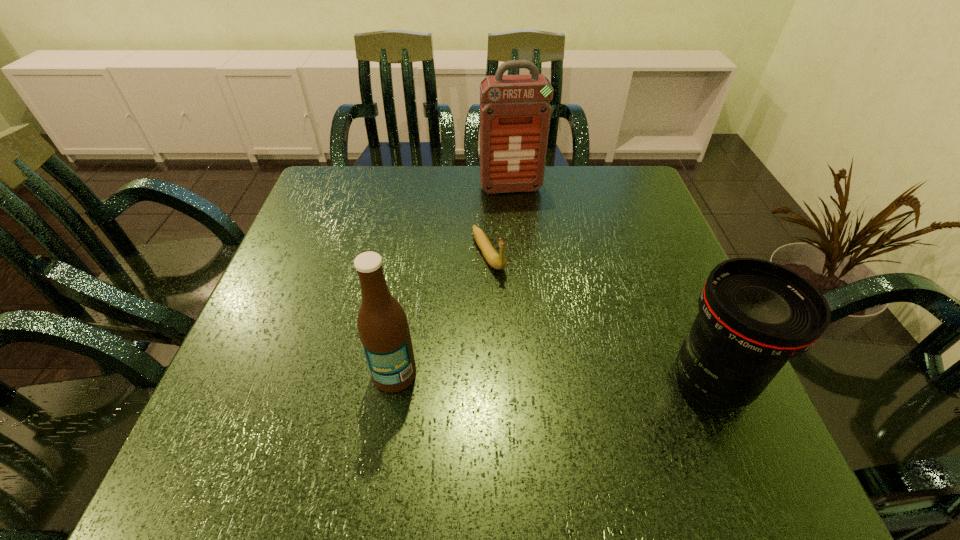
The image size is (960, 540). I want to click on free space located on the front-facing side of the first-aid kit, so click(519, 218).

Locate an element on the screen. Image resolution: width=960 pixels, height=540 pixels. vacant space located 0.260m on the front-facing side of the first-aid kit is located at coordinates (531, 261).

The height and width of the screenshot is (540, 960). I want to click on free space located on the front-facing side of the first-aid kit, so click(525, 241).

In order to click on vacant space located at the stem of the second farthest object in this screenshot , I will do `click(526, 325)`.

The height and width of the screenshot is (540, 960). In order to click on blank area located at the stem of the second farthest object in this screenshot , I will do `click(505, 291)`.

This screenshot has height=540, width=960. Identify the location of vacant region located 0.170m at the stem of the second farthest object. (531, 333).

Locate an element on the screen. The width and height of the screenshot is (960, 540). object that is positioned at the far edge is located at coordinates (515, 112).

Where is `beer bottle present at the near edge`? The image size is (960, 540). beer bottle present at the near edge is located at coordinates [x=382, y=324].

Where is `telephoto lens that is at the near edge`? The height and width of the screenshot is (540, 960). telephoto lens that is at the near edge is located at coordinates (754, 315).

Identify the location of object at the right edge. The width and height of the screenshot is (960, 540). (754, 315).